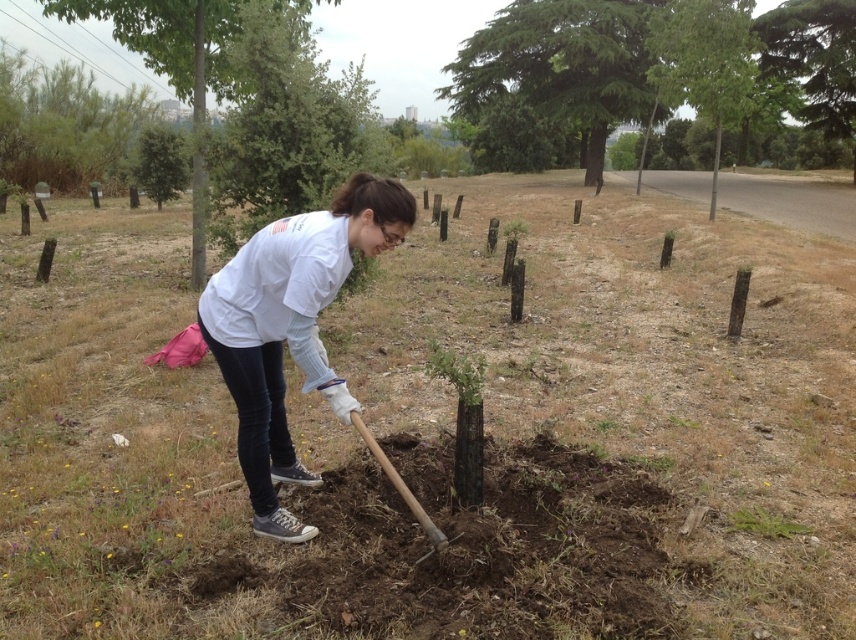
Question: Which point is closer to the camera?

Choices:
 (A) (314, 284)
 (B) (675, 48)
 (C) (171, 68)
 (D) (842, 0)

Answer: (A)

Question: Is green leafy tree at upper left to the left of wooden shovel at center from the viewer's perspective?

Choices:
 (A) no
 (B) yes

Answer: (B)

Question: Considering the real-world distances, which object is farthest from the green textured tree at upper right?

Choices:
 (A) green matte tree at center
 (B) green leafy tree at upper center
 (C) green textured tree at upper center
 (D) wooden shovel at center

Answer: (D)

Question: Among these points, which one is farthest from the camera?

Choices:
 (A) pyautogui.click(x=712, y=204)
 (B) pyautogui.click(x=80, y=13)
 (C) pyautogui.click(x=349, y=416)
 (D) pyautogui.click(x=545, y=44)

Answer: (D)

Question: Is green leafy tree at upper center above wooden shovel at center?

Choices:
 (A) yes
 (B) no

Answer: (A)

Question: Does green leafy tree at upper center appear under wooden shovel at center?

Choices:
 (A) no
 (B) yes

Answer: (A)